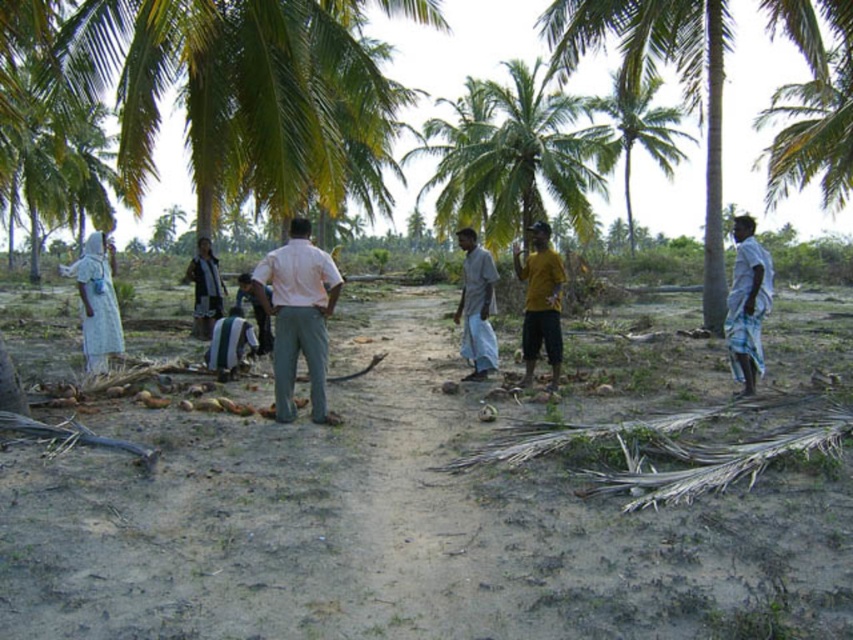
You are a photographer trying to capture a group photo of the pink cotton shirt at center and the dark gray fabric shirt at center. Which person should you ask to stand on a small stool to ensure both are visible in the frame?

The pink cotton shirt at center is not as tall as dark gray fabric shirt at center, so you should ask the person wearing the pink cotton shirt at center to stand on a small stool to ensure both are visible in the frame.

You are planning to set up a small tent in the tropical area shown. The tent requires a space that is at least as large as the green leafy palm tree at upper center. Can the white cloth at left provide enough space for the tent?

The green leafy palm tree at upper center is larger in size than the white cloth at left. Therefore, the white cloth at left cannot provide enough space for the tent since it is smaller than the required size.

You are a photographer standing at the center of the scene. You want to take a photo that includes both the pink cotton shirt at center and the dark gray fabric shirt at center. Given that your camera has a maximum focus range of 8 meters, will you be able to capture both subjects in focus?

The pink cotton shirt at center is 9.00 meters from the dark gray fabric shirt at center. Since the distance between them exceeds the camera maximum focus range of 8 meters, you cannot capture both subjects in focus.